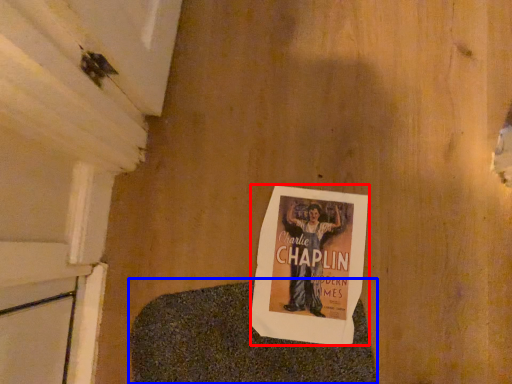
Question: Among these objects, which one is farthest to the camera, poster (highlighted by a red box) or blanket (highlighted by a blue box)?

Choices:
 (A) poster
 (B) blanket

Answer: (A)